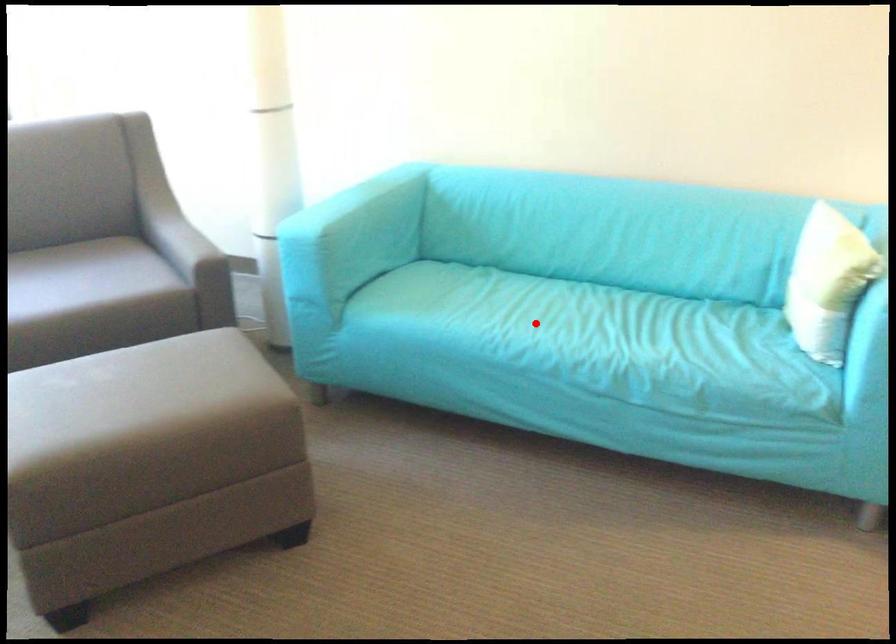
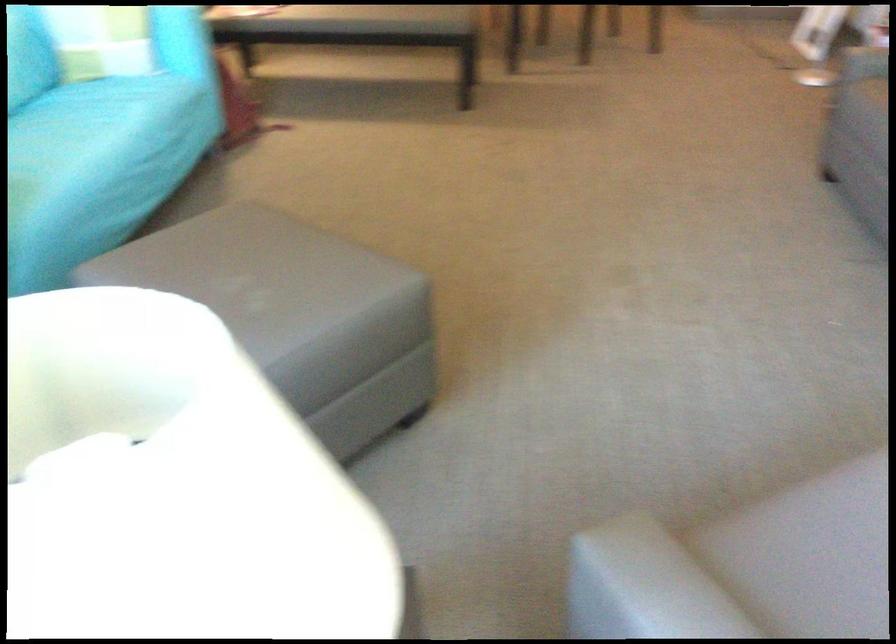
Question: I am providing you with two images of the same scene from different viewpoints. Given a red point in image1, look at the same physical point in image2. Is it:

Choices:
 (A) Closer to the viewpoint
 (B) Farther from the viewpoint

Answer: (B)